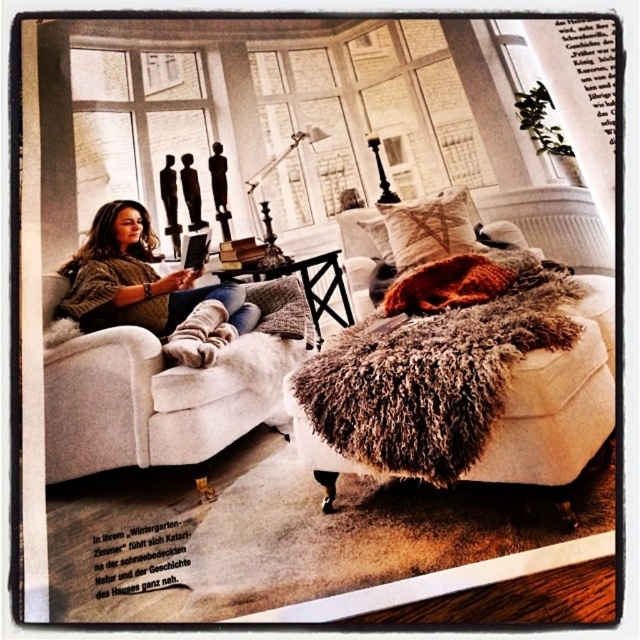
You are a guest in this living room and want to place a small book on the textured beige pillow at center. However, you also have a decorative white soft fabric at center nearby. Which object is taller so that the book will stay upright?

The textured beige pillow at center is much taller than the white soft fabric at center, so placing the book on the textured beige pillow at center will keep it upright.

You are standing in the living room and want to place a small potted plant between the white armchair and the fuzzy fabric ottoman at center. Based on their positions, can you determine which object is closer to the left wall so the plant can be placed appropriately?

The fuzzy fabric ottoman at center is located at point (x=461, y=365), so the white armchair is closer to the left wall. Place the plant between them near the white armchair side.

You are a fashion designer observing the knitted sweater at center and the white soft fabric at center in the living room. Which item has a bigger size?

The knitted sweater at center has a larger size compared to the white soft fabric at center.